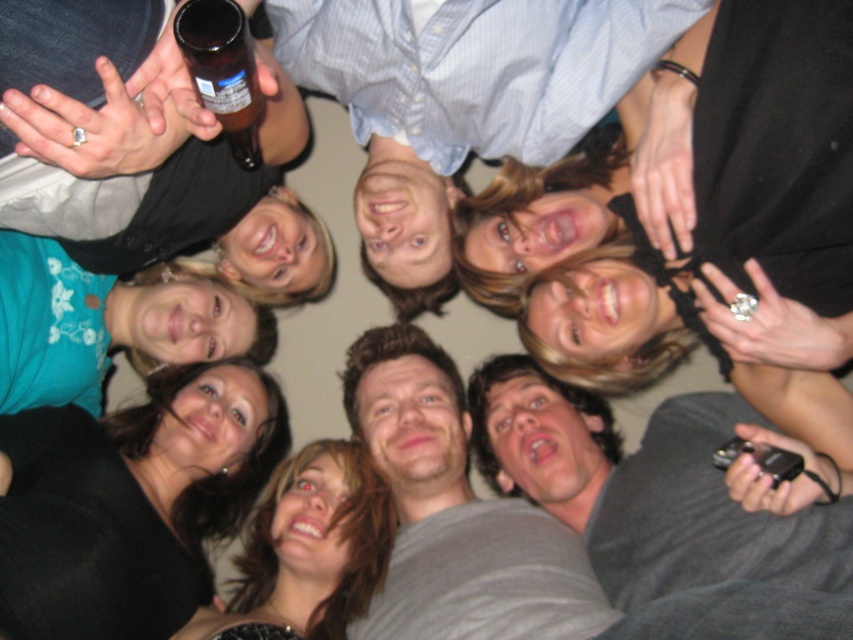
You are a photographer trying to capture a candid shot of the group. You notice the matte black bottle at upper left and the teal fabric shirt at lower left. Which object is located to the right of the other?

The matte black bottle at upper left is positioned on the right side of teal fabric shirt at lower left, so the bottle is to the right of the shirt.